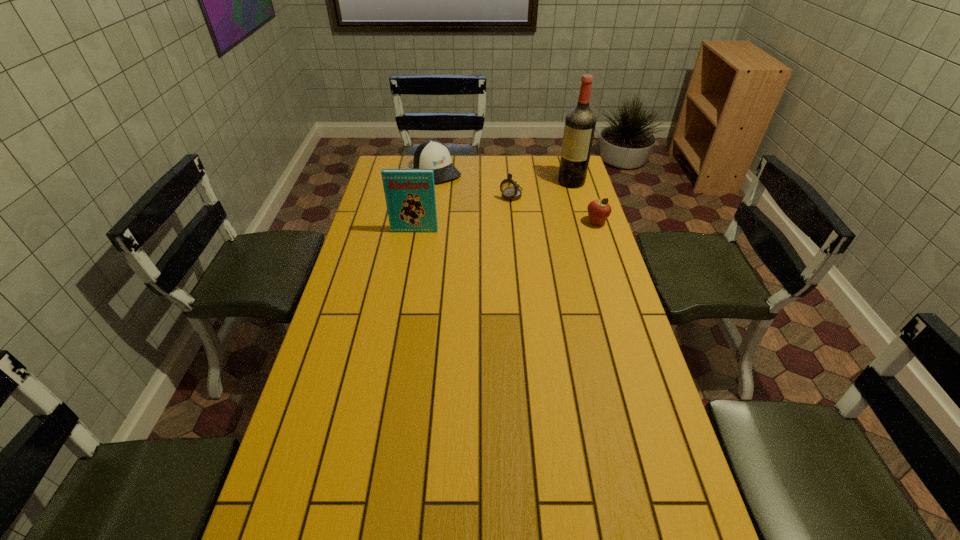
Image resolution: width=960 pixels, height=540 pixels. I want to click on free spot on the desktop that is between the fourth shortest object and the apple and is positioned on the face of the third object from right to left, so click(x=482, y=228).

Image resolution: width=960 pixels, height=540 pixels. Identify the location of free spot on the desktop that is between the book and the apple and is positioned on the front-facing side of the tallest object. (514, 226).

The height and width of the screenshot is (540, 960). In order to click on vacant space on the desktop that is between the book and the apple and is positioned on the front panel of the cap in this screenshot , I will do `click(491, 227)`.